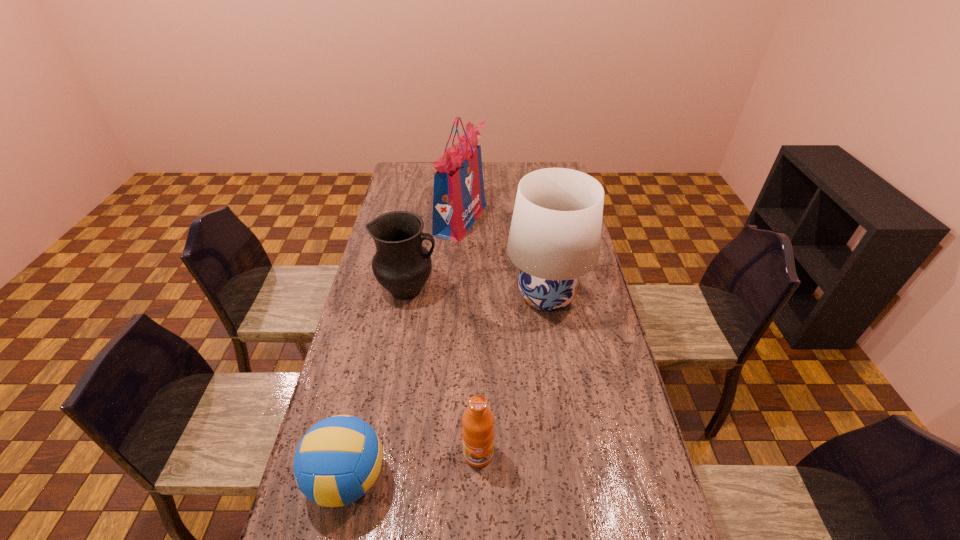
At what (x,y) coordinates should I click in order to perform the action: click on vacant area between the third tallest object and the volleyball. Please return your answer as a coordinate pair (x, y). The width and height of the screenshot is (960, 540). Looking at the image, I should click on (378, 384).

Locate an element on the screen. This screenshot has height=540, width=960. free spot between the rightmost object and the fruit juice is located at coordinates (513, 375).

At what (x,y) coordinates should I click in order to perform the action: click on blank region between the volleyball and the grocery bag. Please return your answer as a coordinate pair (x, y). This screenshot has width=960, height=540. Looking at the image, I should click on (404, 349).

The image size is (960, 540). In order to click on vacant space that is in between the shortest object and the lampshade in this screenshot , I will do `click(446, 387)`.

I want to click on free space between the fourth tallest object and the pitcher, so click(x=444, y=372).

At what (x,y) coordinates should I click in order to perform the action: click on empty space between the fourth tallest object and the third shortest object. Please return your answer as a coordinate pair (x, y). The height and width of the screenshot is (540, 960). Looking at the image, I should click on (444, 372).

This screenshot has height=540, width=960. Identify the location of free space between the farthest object and the rightmost object. (503, 258).

The width and height of the screenshot is (960, 540). Identify the location of object that ranks as the third closest to the rightmost object. (478, 432).

Locate an element on the screen. object that is the fourth closest one to the lampshade is located at coordinates (338, 460).

The width and height of the screenshot is (960, 540). What are the coordinates of `vacant space that satisfies the following two spatial constraints: 1. on the handle side of the pitcher; 2. on the front side of the volleyball` in the screenshot? It's located at (375, 478).